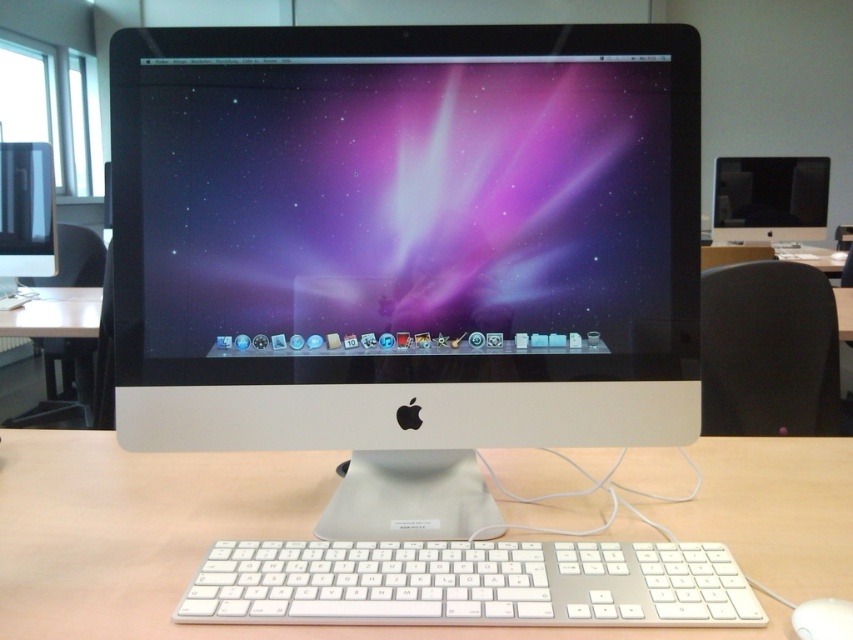
Looking at this image, does satin black monitor at upper right appear on the left side of matte black monitor at left?

Incorrect, satin black monitor at upper right is not on the left side of matte black monitor at left.

Is satin black monitor at upper right thinner than matte black monitor at left?

No, satin black monitor at upper right is not thinner than matte black monitor at left.

Who is more distant from viewer, (805,179) or (0,248)?

Positioned behind is point (805,179).

Locate an element on the screen. This screenshot has width=853, height=640. satin black monitor at upper right is located at coordinates (770, 198).

Is black plastic chair at right bigger than satin black monitor at upper right?

Yes, black plastic chair at right is bigger than satin black monitor at upper right.

Between black plastic chair at right and satin black monitor at upper right, which one appears on the left side from the viewer's perspective?

black plastic chair at right

Which is behind, point (816, 342) or point (827, 202)?

Point (827, 202)

At what (x,y) coordinates should I click in order to perform the action: click on black plastic chair at right. Please return your answer as a coordinate pair (x, y). The width and height of the screenshot is (853, 640). Looking at the image, I should click on (769, 349).

Does black plastic chair at right have a larger size compared to matte black monitor at left?

Incorrect, black plastic chair at right is not larger than matte black monitor at left.

Does point (770, 301) come farther from viewer compared to point (41, 273)?

No, (770, 301) is in front of (41, 273).

The width and height of the screenshot is (853, 640). I want to click on black plastic chair at right, so click(769, 349).